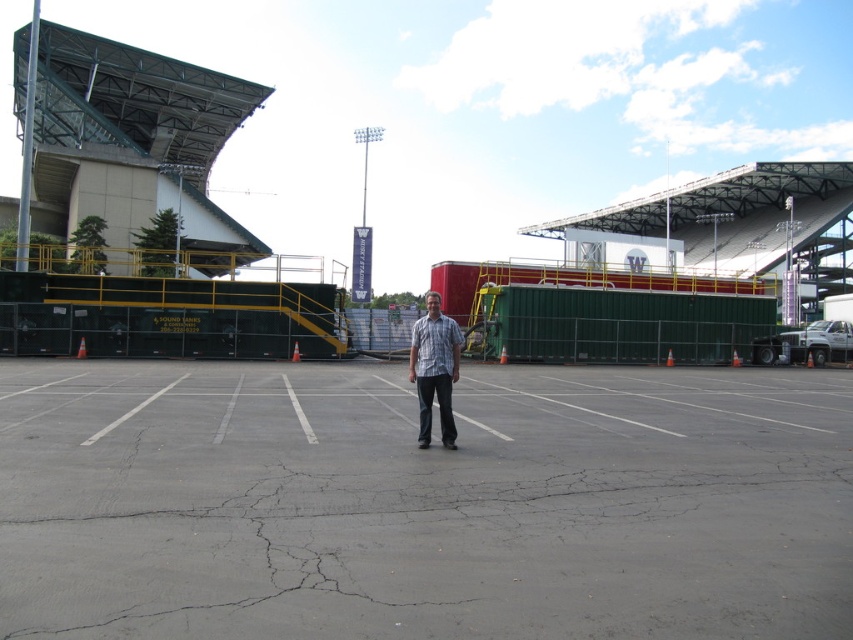
You are standing at the edge of the gray asphalt parking lot at center and want to walk to the plaid shirt at center. Which direction should you move to reach it?

You should move to the right because the gray asphalt parking lot at center is to the left of the plaid shirt at center, so moving right from the parking lot will lead you towards the plaid shirt at center.